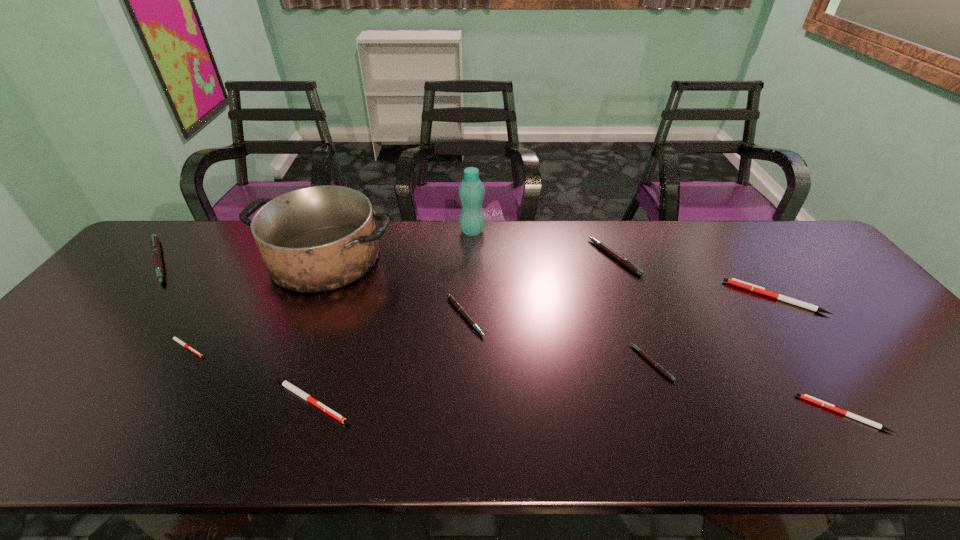
The image size is (960, 540). Find the location of `the smallest pink pen`. the smallest pink pen is located at coordinates (658, 366).

I want to click on the third biggest white pen, so click(x=809, y=398).

Find the location of a particular element. This screenshot has width=960, height=540. the shortest object is located at coordinates (176, 339).

Find the location of a particular element. The width and height of the screenshot is (960, 540). the leftmost white pen is located at coordinates (176, 339).

Where is `vacant space positioned 0.400m on the front of the bottle`? vacant space positioned 0.400m on the front of the bottle is located at coordinates (469, 331).

The width and height of the screenshot is (960, 540). What are the coordinates of `free space located on the front of the ninth shortest object` in the screenshot? It's located at (295, 329).

Where is `free region located 0.340m at the nib of the tallest pen`? Image resolution: width=960 pixels, height=540 pixels. free region located 0.340m at the nib of the tallest pen is located at coordinates (296, 261).

This screenshot has width=960, height=540. What are the coordinates of `free space located at the nib of the third smallest pink pen` in the screenshot? It's located at (547, 257).

At what (x,y) coordinates should I click in order to perform the action: click on free spot located 0.290m at the nib of the third smallest pink pen. Please return your answer as a coordinate pair (x, y). Looking at the image, I should click on pyautogui.click(x=498, y=257).

Find the location of a particular element. The width and height of the screenshot is (960, 540). vacant space situated 0.370m at the nib of the third smallest pink pen is located at coordinates (472, 257).